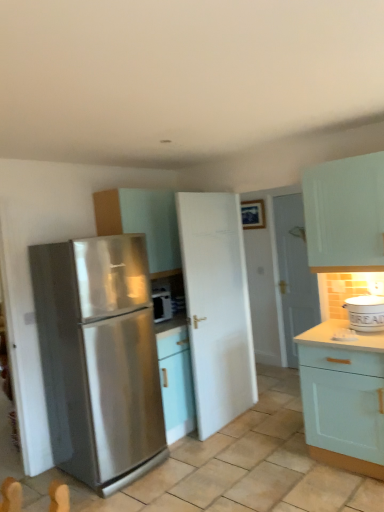
The image size is (384, 512). I want to click on vacant area located to the right-hand side of stainless steel refrigerator at left, so click(194, 472).